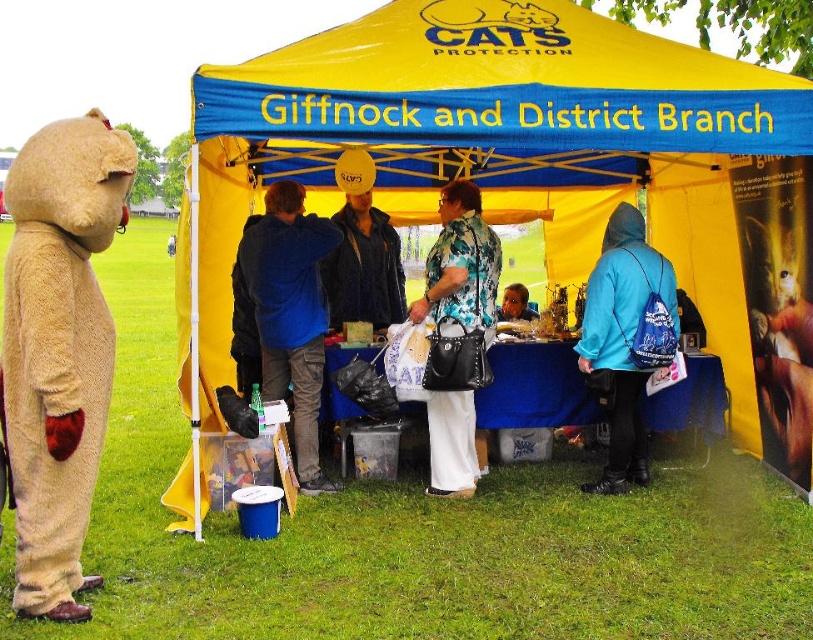
Does yellow fabric tent at center appear on the right side of floral fabric blouse at center?

In fact, yellow fabric tent at center is to the left of floral fabric blouse at center.

Can you confirm if yellow fabric tent at center is bigger than floral fabric blouse at center?

Yes, yellow fabric tent at center is bigger than floral fabric blouse at center.

Locate an element on the screen. yellow fabric tent at center is located at coordinates (489, 145).

Is point (592, 68) positioned before point (372, 307)?

Yes.

Can you confirm if yellow fabric tent at center is positioned below blue denim jacket at center?

No, yellow fabric tent at center is not below blue denim jacket at center.

Locate an element on the screen. This screenshot has width=813, height=640. yellow fabric tent at center is located at coordinates (489, 145).

You are a GUI agent. You are given a task and a screenshot of the screen. Output one action in this format:
    pyautogui.click(x=<x>, y=<y>)
    Task: Click on the yellow fabric tent at center
    This screenshot has width=813, height=640.
    Given the screenshot: What is the action you would take?
    pyautogui.click(x=489, y=145)

Does fuzzy beige bear at left appear over floral fabric blouse at center?

Incorrect, fuzzy beige bear at left is not positioned above floral fabric blouse at center.

What do you see at coordinates (59, 348) in the screenshot?
I see `fuzzy beige bear at left` at bounding box center [59, 348].

At what (x,y) coordinates should I click in order to perform the action: click on fuzzy beige bear at left. Please return your answer as a coordinate pair (x, y). This screenshot has width=813, height=640. Looking at the image, I should click on (59, 348).